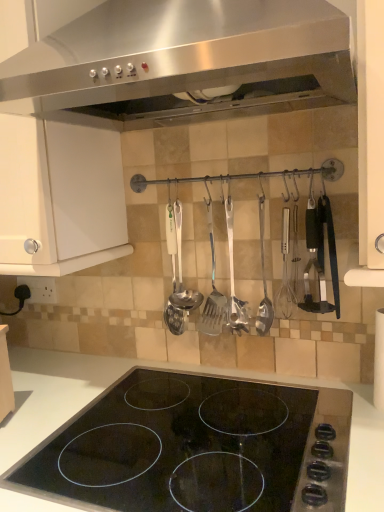
What is the approximate height of polished stainless steel spatula at center, marked as the 3th silverware in a left-to-right arrangement?

It is 14.01 inches.

What do you see at coordinates (181, 272) in the screenshot?
I see `metallic silver ladle at center` at bounding box center [181, 272].

How much space does polished metal ladle at center, positioned as the 4th silverware in left-to-right order, occupy horizontally?

polished metal ladle at center, positioned as the 4th silverware in left-to-right order, is 4.42 centimeters wide.

Identify the location of stainless steel range hood at upper center. (180, 60).

At what (x,y) coordinates should I click in order to perform the action: click on metallic spatula at center, marked as the 3th silverware in a right-to-left arrangement. Please return your answer as a coordinate pair (x, y). Image resolution: width=384 pixels, height=512 pixels. Looking at the image, I should click on (212, 290).

Find the location of `white matte cabinet at upper left`. white matte cabinet at upper left is located at coordinates (59, 197).

At what (x,y) coordinates should I click in order to perform the action: click on polished stainless steel spatula at center, marked as the 3th silverware in a left-to-right arrangement. Please return your answer as a coordinate pair (x, y). This screenshot has height=512, width=384. Looking at the image, I should click on (233, 280).

Is black glass stovetop at center turned away from stainless steel range hood at upper center?

No, black glass stovetop at center is not facing the opposite direction of stainless steel range hood at upper center.

Do you think black glass stovetop at center is within stainless steel range hood at upper center, or outside of it?

black glass stovetop at center lies outside stainless steel range hood at upper center.

Which of these two, black glass stovetop at center or stainless steel range hood at upper center, is thinner?

stainless steel range hood at upper center is thinner.

Is black glass stovetop at center touching stainless steel range hood at upper center?

No, black glass stovetop at center is not next to stainless steel range hood at upper center.

Which is behind, white matte cabinet at upper left or stainless steel range hood at upper center?

white matte cabinet at upper left is behind.

Locate an element on the screen. kitchen appliance in front of the white matte cabinet at upper left is located at coordinates (180, 60).

Is white matte cabinet at upper left beside stainless steel range hood at upper center?

No, white matte cabinet at upper left is not beside stainless steel range hood at upper center.

Is white matte cabinet at upper left turned away from stainless steel range hood at upper center?

No, white matte cabinet at upper left's orientation is not away from stainless steel range hood at upper center.

Can you confirm if polished stainless steel spatula at center, placed as the 2th silverware when sorted from right to left, is positioned to the left of polished metal ladle at center, positioned as the 4th silverware in left-to-right order?

Yes.

Is polished stainless steel spatula at center, marked as the 3th silverware in a left-to-right arrangement, not within polished metal ladle at center, marked as the first silverware in a right-to-left arrangement?

Yes, polished stainless steel spatula at center, marked as the 3th silverware in a left-to-right arrangement, is not within polished metal ladle at center, marked as the first silverware in a right-to-left arrangement.

How many degrees apart are the facing directions of polished stainless steel spatula at center, marked as the 3th silverware in a left-to-right arrangement, and polished metal ladle at center, marked as the first silverware in a right-to-left arrangement?

polished stainless steel spatula at center, marked as the 3th silverware in a left-to-right arrangement, and polished metal ladle at center, marked as the first silverware in a right-to-left arrangement, are facing 0.0265 degrees away from each other.

Does polished stainless steel ladle at center, which is counted as the first silverware, starting from the left, have a lesser width compared to metallic silver ladle at center?

Indeed, polished stainless steel ladle at center, which is counted as the first silverware, starting from the left, has a lesser width compared to metallic silver ladle at center.

From the picture: From a real-world perspective, which is physically above, polished stainless steel ladle at center, which is counted as the first silverware, starting from the left, or metallic silver ladle at center?

metallic silver ladle at center, from a real-world perspective.

Is point (172, 312) positioned in front of point (178, 219)?

No, it is not.

Which of these two, polished stainless steel ladle at center, which is counted as the first silverware, starting from the left, or metallic silver ladle at center, stands shorter?

Standing shorter between the two is metallic silver ladle at center.

From the picture: Is metallic silver ladle at center facing towards white matte cabinet at upper left?

No.

Which of these two, metallic silver ladle at center or white matte cabinet at upper left, is bigger?

Bigger between the two is white matte cabinet at upper left.

Considering the sizes of objects metallic silver ladle at center and white matte cabinet at upper left in the image provided, who is taller, metallic silver ladle at center or white matte cabinet at upper left?

white matte cabinet at upper left.

Is metallic silver ladle at center closer to the viewer compared to white matte cabinet at upper left?

No, metallic silver ladle at center is further to the viewer.

Is white matte cabinet at upper left aimed at polished metal ladle at center, positioned as the 4th silverware in left-to-right order?

No, white matte cabinet at upper left is not facing towards polished metal ladle at center, positioned as the 4th silverware in left-to-right order.

From the image's perspective, relative to polished metal ladle at center, positioned as the 4th silverware in left-to-right order, is white matte cabinet at upper left above or below?

Based on their image positions, white matte cabinet at upper left is located above polished metal ladle at center, positioned as the 4th silverware in left-to-right order.

Who is more distant, white matte cabinet at upper left or polished metal ladle at center, positioned as the 4th silverware in left-to-right order?

polished metal ladle at center, positioned as the 4th silverware in left-to-right order, is more distant.

Is white matte cabinet at upper left positioned far away from polished metal ladle at center, positioned as the 4th silverware in left-to-right order?

white matte cabinet at upper left is near polished metal ladle at center, positioned as the 4th silverware in left-to-right order, not far away.

Consider the image. Can you confirm if metallic spatula at center, acting as the 2th silverware starting from the left, is wider than metallic silver ladle at center?

In fact, metallic spatula at center, acting as the 2th silverware starting from the left, might be narrower than metallic silver ladle at center.

Is metallic spatula at center, acting as the 2th silverware starting from the left, positioned far away from metallic silver ladle at center?

No, metallic spatula at center, acting as the 2th silverware starting from the left, is not far from metallic silver ladle at center.

Which object is closer to the camera, metallic spatula at center, acting as the 2th silverware starting from the left, or metallic silver ladle at center?

metallic spatula at center, acting as the 2th silverware starting from the left, is more forward.

Based on the photo, from a real-world perspective, is metallic spatula at center, marked as the 3th silverware in a right-to-left arrangement, physically below metallic silver ladle at center?

Correct, in the physical world, metallic spatula at center, marked as the 3th silverware in a right-to-left arrangement, is lower than metallic silver ladle at center.

Identify the location of countertop that appears below the stainless steel range hood at upper center (from the image's perspective). The width and height of the screenshot is (384, 512). tap(173, 369).

Locate an element on the screen. kitchen appliance above the white matte cabinet at upper left (from a real-world perspective) is located at coordinates (180, 60).

Based on their spatial positions, is polished stainless steel ladle at center, the 4th silverware viewed from the right, or metallic silver ladle at center further from stainless steel range hood at upper center?

polished stainless steel ladle at center, the 4th silverware viewed from the right, is further to stainless steel range hood at upper center.

When comparing their distances from white matte cabinet at upper left, does black glass stovetop at center or polished stainless steel ladle at center, which is counted as the first silverware, starting from the left, seem closer?

polished stainless steel ladle at center, which is counted as the first silverware, starting from the left, is positioned closer to the anchor white matte cabinet at upper left.

Based on their spatial positions, is stainless steel range hood at upper center or polished stainless steel spatula at center, marked as the 3th silverware in a left-to-right arrangement, closer to white matte cabinet at upper left?

stainless steel range hood at upper center.

Which object lies further to the anchor point white matte cabinet at upper left, polished metal ladle at center, positioned as the 4th silverware in left-to-right order, or metallic silver ladle at center?

polished metal ladle at center, positioned as the 4th silverware in left-to-right order, is further to white matte cabinet at upper left.

Which object lies further to the anchor point metallic spatula at center, acting as the 2th silverware starting from the left, polished stainless steel spatula at center, placed as the 2th silverware when sorted from right to left, or polished stainless steel ladle at center, the 4th silverware viewed from the right?

polished stainless steel ladle at center, the 4th silverware viewed from the right, is positioned further to the anchor metallic spatula at center, acting as the 2th silverware starting from the left.

From the image, which object appears to be nearer to metallic silver ladle at center, polished stainless steel spatula at center, marked as the 3th silverware in a left-to-right arrangement, or metallic spatula at center, acting as the 2th silverware starting from the left?

metallic spatula at center, acting as the 2th silverware starting from the left, lies closer to metallic silver ladle at center than the other object.

Considering their positions, is white matte cabinet at upper left positioned closer to polished metal ladle at center, marked as the first silverware in a right-to-left arrangement, than metallic silver ladle at center?

metallic silver ladle at center lies closer to polished metal ladle at center, marked as the first silverware in a right-to-left arrangement, than the other object.

Based on their spatial positions, is stainless steel range hood at upper center or polished stainless steel ladle at center, the 4th silverware viewed from the right, closer to metallic spatula at center, marked as the 3th silverware in a right-to-left arrangement?

polished stainless steel ladle at center, the 4th silverware viewed from the right, is closer to metallic spatula at center, marked as the 3th silverware in a right-to-left arrangement.

At what (x,y) coordinates should I click in order to perform the action: click on silverware located between black glass stovetop at center and polished stainless steel spatula at center, marked as the 3th silverware in a left-to-right arrangement, in the depth direction. Please return your answer as a coordinate pair (x, y). This screenshot has width=384, height=512. Looking at the image, I should click on (263, 282).

Locate an element on the screen. cabinetry that lies between stainless steel range hood at upper center and black glass stovetop at center from top to bottom is located at coordinates (59, 197).

Find the location of a particular element. This screenshot has height=512, width=384. silverware between metallic spatula at center, acting as the 2th silverware starting from the left, and polished metal ladle at center, positioned as the 4th silverware in left-to-right order is located at coordinates (233, 280).

Where is `utensil between polished stainless steel ladle at center, which is counted as the first silverware, starting from the left, and polished metal ladle at center, marked as the first silverware in a right-to-left arrangement, from left to right`? This screenshot has height=512, width=384. utensil between polished stainless steel ladle at center, which is counted as the first silverware, starting from the left, and polished metal ladle at center, marked as the first silverware in a right-to-left arrangement, from left to right is located at coordinates (181, 272).